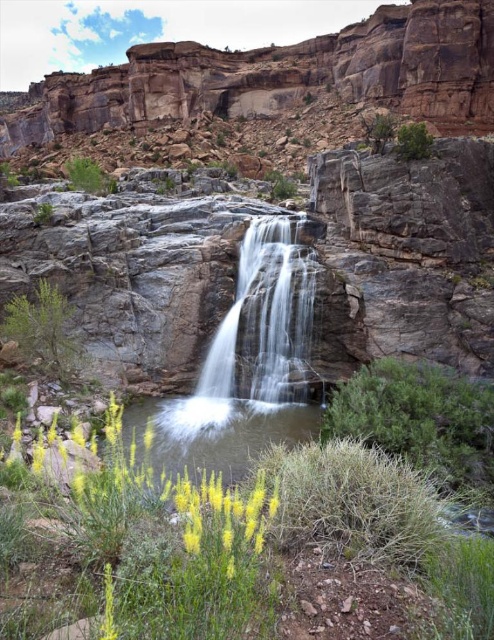
Consider the image. Does white smooth waterfall at center have a greater height compared to green leafy bush at lower right?

Yes, white smooth waterfall at center is taller than green leafy bush at lower right.

Does white smooth waterfall at center have a lesser width compared to green leafy bush at lower right?

Incorrect, white smooth waterfall at center's width is not less than green leafy bush at lower right's.

Is point (280, 320) positioned before point (483, 454)?

No, it is behind (483, 454).

The width and height of the screenshot is (494, 640). I want to click on white smooth waterfall at center, so click(x=252, y=340).

Does green leafy bush at lower right come behind green leafy bush at upper right?

That is False.

Is green leafy bush at lower right above green leafy bush at upper right?

Incorrect, green leafy bush at lower right is not positioned above green leafy bush at upper right.

Is point (398, 410) more distant than point (427, 132)?

No, (398, 410) is in front of (427, 132).

Locate an element on the screen. green leafy bush at lower right is located at coordinates (419, 419).

Who is more forward, [73,176] or [411,129]?

Point [411,129] is more forward.

Is green leafy shrub at upper left further to camera compared to green leafy bush at upper right?

Yes, it is.

Is point (98, 180) in front of point (426, 148)?

That is False.

You are a GUI agent. You are given a task and a screenshot of the screen. Output one action in this format:
    pyautogui.click(x=<x>, y=<y>)
    Task: Click on the green leafy shrub at upper left
    Image resolution: width=494 pixels, height=640 pixels.
    Given the screenshot: What is the action you would take?
    pyautogui.click(x=87, y=176)